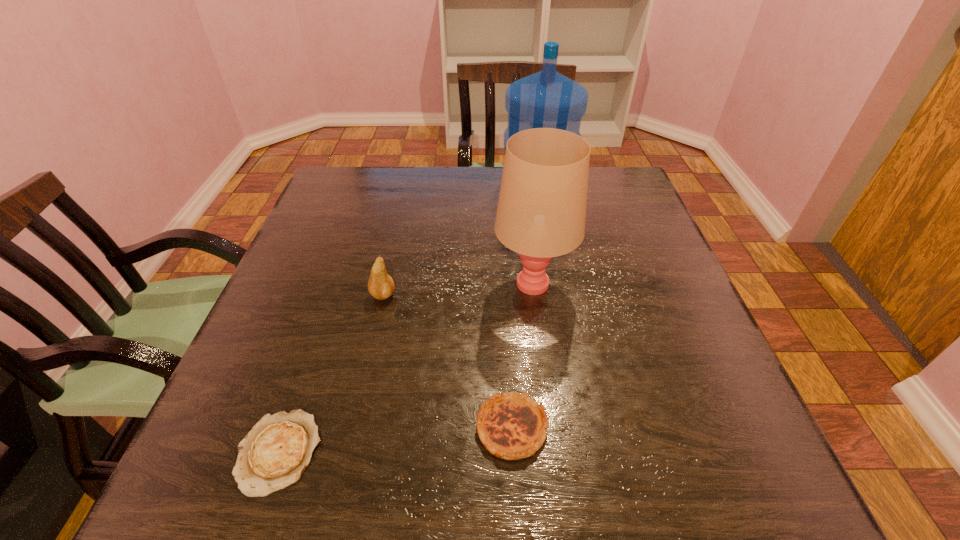
At what (x,y) coordinates should I click in order to perform the action: click on vacant region at the far left corner of the desktop. Please return your answer as a coordinate pair (x, y). The width and height of the screenshot is (960, 540). Looking at the image, I should click on (373, 184).

You are a GUI agent. You are given a task and a screenshot of the screen. Output one action in this format:
    pyautogui.click(x=<x>, y=<y>)
    Task: Click on the free space at the far right corner of the desktop
    Image resolution: width=960 pixels, height=540 pixels.
    Given the screenshot: What is the action you would take?
    pyautogui.click(x=636, y=200)

Image resolution: width=960 pixels, height=540 pixels. What are the coordinates of `vacant area that lies between the farthest object and the leftmost object` in the screenshot? It's located at [x=408, y=319].

Identify the location of vacant space in between the fourth shortest object and the leftmost object. (406, 368).

Locate an element on the screen. This screenshot has height=540, width=960. empty location between the left quiche and the right quiche is located at coordinates [396, 441].

Where is `empty location between the taller quiche and the pear`? empty location between the taller quiche and the pear is located at coordinates (447, 362).

Find the location of a particular element. Image resolution: width=960 pixels, height=540 pixels. empty space that is in between the lampshade and the pear is located at coordinates (458, 289).

Find the location of `free area in between the pear and the water jug`. free area in between the pear and the water jug is located at coordinates (461, 240).

This screenshot has height=540, width=960. Find the location of `vacant region between the fourth tallest object and the shorter quiche`. vacant region between the fourth tallest object and the shorter quiche is located at coordinates (396, 441).

Identify the location of vacant space that is in between the second tallest object and the shortest object. (406, 368).